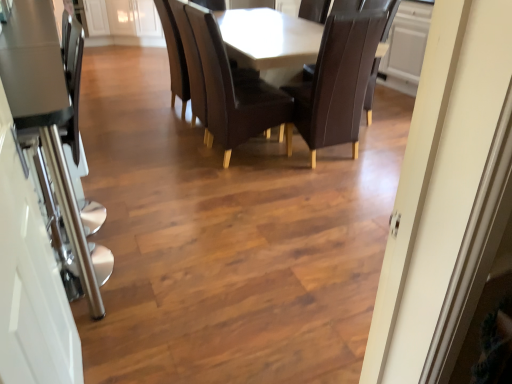
At what (x,y) coordinates should I click in order to perform the action: click on vacant area that is in front of dark brown leather chair at center, which ranks as the second chair in left-to-right order. Please return your answer as a coordinate pair (x, y). Looking at the image, I should click on (351, 188).